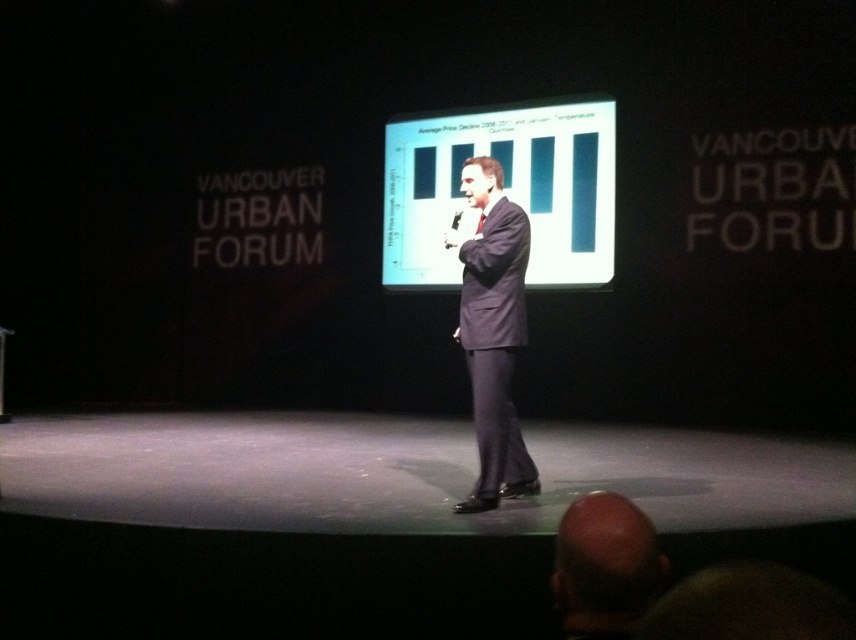
Based on the photo, you are an event coordinator at the Vancouver Urban Forum. You need to ensure that the presenter can easily access the microphone while moving around the stage. Given that the presenter is wearing a dark suit at center and there is a black plastic microphone at center, what is the minimum distance you should maintain between them to allow comfortable access?

The distance between the dark suit at center and the black plastic microphone at center is 22.55 inches. To ensure comfortable access, the presenter should maintain at least this distance, which allows for natural movement without being too far to reach the microphone.